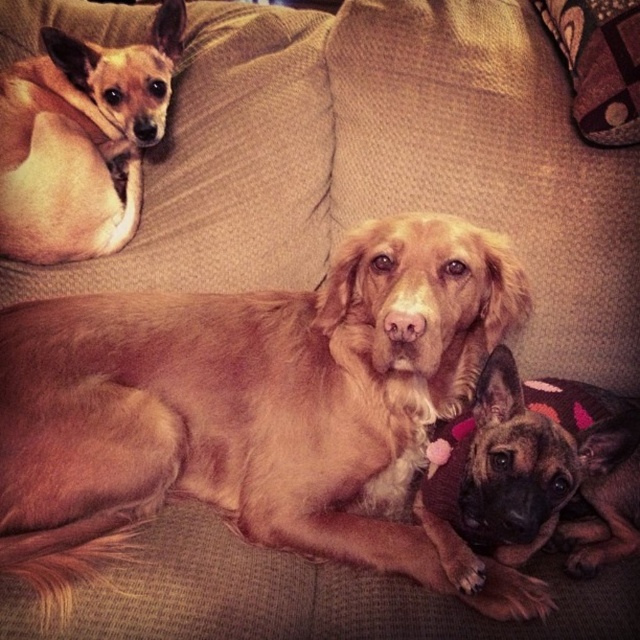
Question: Among these objects, which one is farthest from the camera?

Choices:
 (A) brown furry dog at lower right
 (B) light brown fur at upper left

Answer: (B)

Question: Which of the following is the farthest from the observer?

Choices:
 (A) brown furry dog at lower right
 (B) light brown fur at upper left

Answer: (B)

Question: Can you confirm if light brown fur at upper left is positioned to the left of brown furry dog at lower right?

Choices:
 (A) yes
 (B) no

Answer: (A)

Question: Can you confirm if light brown fur at upper left is smaller than brown furry dog at lower right?

Choices:
 (A) yes
 (B) no

Answer: (A)

Question: From the image, what is the correct spatial relationship of light brown fur at upper left in relation to brown furry dog at lower right?

Choices:
 (A) left
 (B) right

Answer: (A)